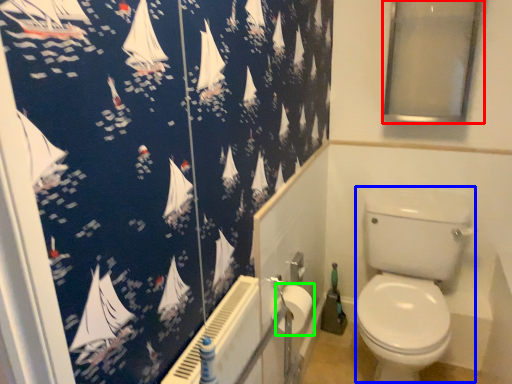
Question: Estimate the real-world distances between objects in this image. Which object is closer to window screen (highlighted by a red box), toilet bowl (highlighted by a blue box) or toilet paper (highlighted by a green box)?

Choices:
 (A) toilet bowl
 (B) toilet paper

Answer: (A)